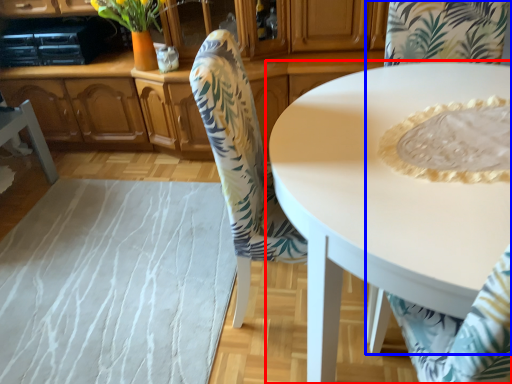
Question: Which object is further to the camera taking this photo, coffee table (highlighted by a red box) or chair (highlighted by a blue box)?

Choices:
 (A) coffee table
 (B) chair

Answer: (A)